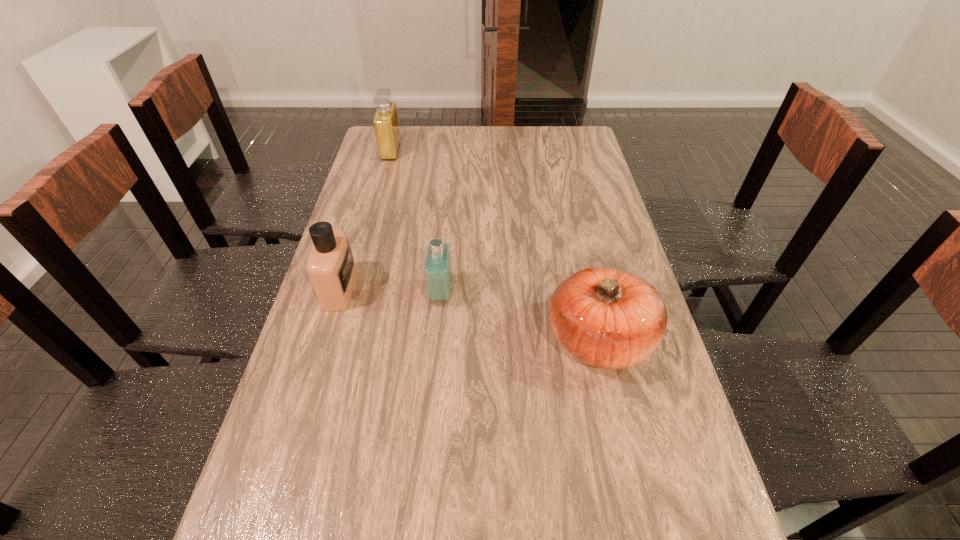
The width and height of the screenshot is (960, 540). Identify the location of object that stands as the closest to the farthest perfume. (330, 265).

Point out which object is positioned as the nearest to the second object from right to left. Please provide its 2D coordinates. Your answer should be formatted as a tuple, i.e. [(x, y)], where the tuple contains the x and y coordinates of a point satisfying the conditions above.

[(330, 265)]

Select which perfume appears as the closest to the rightmost perfume. Please provide its 2D coordinates. Your answer should be formatted as a tuple, i.e. [(x, y)], where the tuple contains the x and y coordinates of a point satisfying the conditions above.

[(330, 265)]

Identify which perfume is the nearest to the shortest perfume. Please provide its 2D coordinates. Your answer should be formatted as a tuple, i.e. [(x, y)], where the tuple contains the x and y coordinates of a point satisfying the conditions above.

[(330, 265)]

Identify the location of free region that satisfies the following two spatial constraints: 1. on the front label of the third object from left to right; 2. on the left side of the pumpkin. The width and height of the screenshot is (960, 540). (437, 340).

Find the location of a particular element. vacant position in the image that satisfies the following two spatial constraints: 1. on the front label of the pumpkin; 2. on the right side of the rightmost perfume is located at coordinates (437, 340).

Find the location of `vacant area in the image that satisfies the following two spatial constraints: 1. on the front label of the third object from left to right; 2. on the right side of the pumpkin`. vacant area in the image that satisfies the following two spatial constraints: 1. on the front label of the third object from left to right; 2. on the right side of the pumpkin is located at coordinates (437, 340).